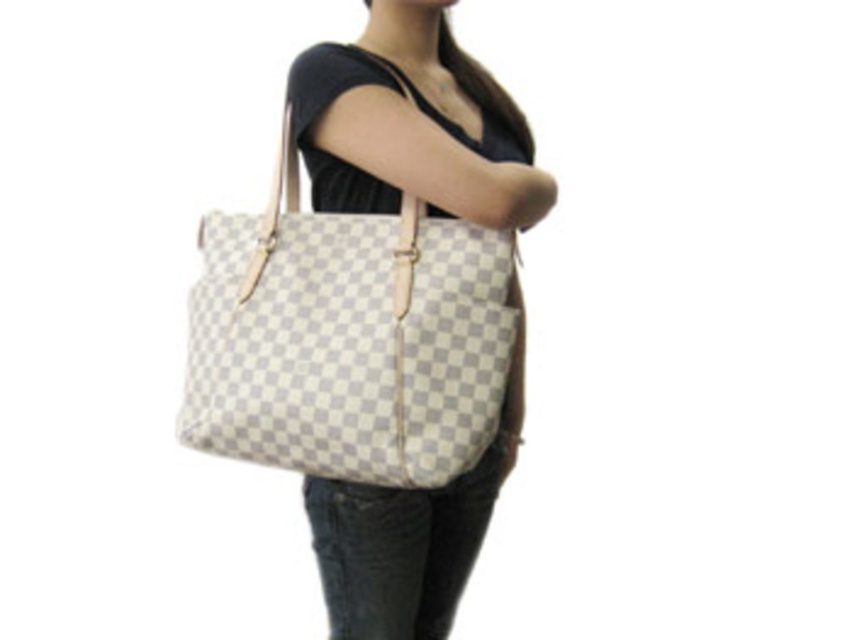
You are an assistant analyzing the image. There are two points labeled as point (384, 240) and point (424, 99) in the scene. Which point is nearer to you?

Point (384, 240) is closer to the viewer than point (424, 99).

You are a fashion designer trying to arrange a photo shoot. You have a model wearing denim at lower center and holding a white checkered fabric tote at center. To make the outfit more balanced, should you place the tote to the left or right side of the denim?

The white checkered fabric tote at center is already to the left of denim at lower center. To maintain balance, keep the tote to the left of the denim.